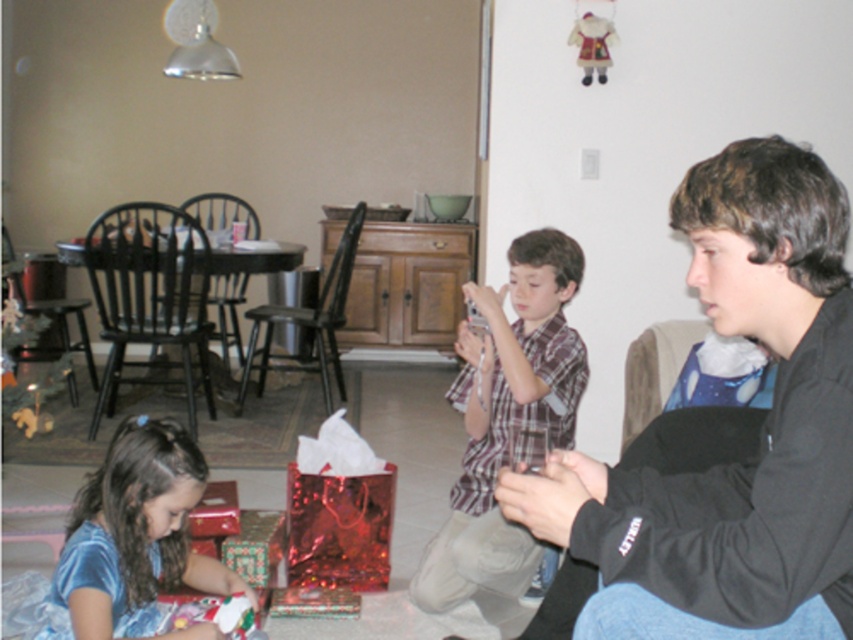
Question: Which point is farther from the camera taking this photo?

Choices:
 (A) (183, 611)
 (B) (227, 218)
 (C) (541, 257)
 (D) (236, 412)

Answer: (B)

Question: Which point is farther from the camera taking this photo?

Choices:
 (A) (202, 294)
 (B) (819, 452)
 (C) (453, 568)
 (D) (322, 323)

Answer: (D)

Question: Can you confirm if plaid fabric shirt at center is bigger than black wood armchair at left?

Choices:
 (A) no
 (B) yes

Answer: (A)

Question: Does metallic black armchair at left appear on the right side of velvet plush santa at upper right?

Choices:
 (A) no
 (B) yes

Answer: (A)

Question: Is black wood armchair at left positioned behind black wood chair at center?

Choices:
 (A) yes
 (B) no

Answer: (B)

Question: Which point is farther to the camera?

Choices:
 (A) black wood dining chair at center
 (B) shiny metallic wrapping paper at lower left
 (C) velvet plush santa at upper right
 (D) black wood chair at center

Answer: (A)